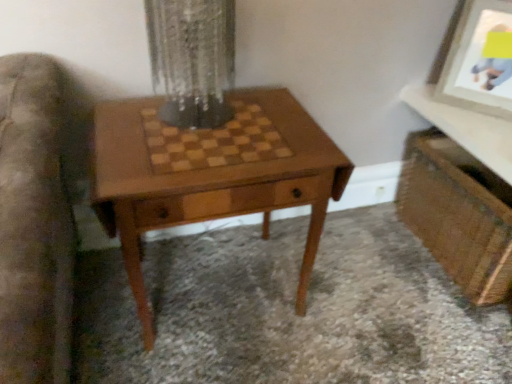
Question: Should I look upward or downward to see wooden chessboard at upper right?

Choices:
 (A) up
 (B) down

Answer: (A)

Question: Can we say matte white picture frame at upper right lies outside clear glass vase at center?

Choices:
 (A) yes
 (B) no

Answer: (A)

Question: Can you confirm if matte white picture frame at upper right is smaller than clear glass vase at center?

Choices:
 (A) yes
 (B) no

Answer: (A)

Question: Is matte white picture frame at upper right positioned in front of clear glass vase at center?

Choices:
 (A) no
 (B) yes

Answer: (A)

Question: Considering the relative sizes of matte white picture frame at upper right and clear glass vase at center in the image provided, is matte white picture frame at upper right taller than clear glass vase at center?

Choices:
 (A) yes
 (B) no

Answer: (A)

Question: Does matte white picture frame at upper right have a lesser width compared to clear glass vase at center?

Choices:
 (A) no
 (B) yes

Answer: (B)

Question: Are matte white picture frame at upper right and clear glass vase at center located far from each other?

Choices:
 (A) yes
 (B) no

Answer: (B)

Question: Is matte white picture frame at upper right shorter than wooden chess table at center?

Choices:
 (A) yes
 (B) no

Answer: (A)

Question: Is matte white picture frame at upper right bigger than wooden chess table at center?

Choices:
 (A) no
 (B) yes

Answer: (A)

Question: Does matte white picture frame at upper right come behind wooden chess table at center?

Choices:
 (A) yes
 (B) no

Answer: (A)

Question: Is matte white picture frame at upper right facing towards wooden chess table at center?

Choices:
 (A) yes
 (B) no

Answer: (B)

Question: From a real-world perspective, is matte white picture frame at upper right beneath wooden chess table at center?

Choices:
 (A) yes
 (B) no

Answer: (B)

Question: From a real-world perspective, is matte white picture frame at upper right positioned over wooden chess table at center based on gravity?

Choices:
 (A) yes
 (B) no

Answer: (A)

Question: From a real-world perspective, is wooden vanity at lower right over clear glass vase at center?

Choices:
 (A) no
 (B) yes

Answer: (A)